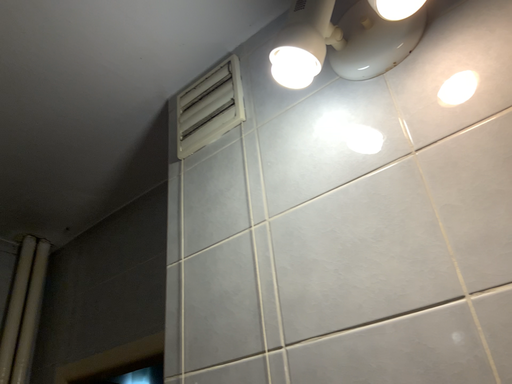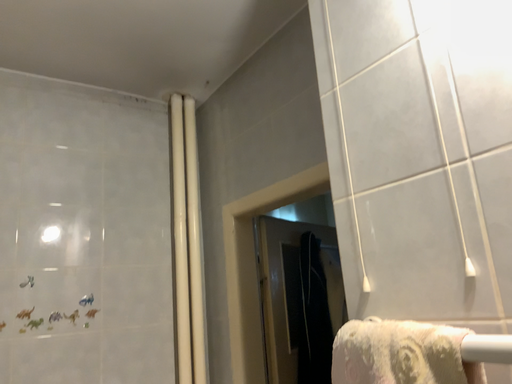
Question: How did the camera likely rotate when shooting the video?

Choices:
 (A) rotated right
 (B) rotated left

Answer: (B)